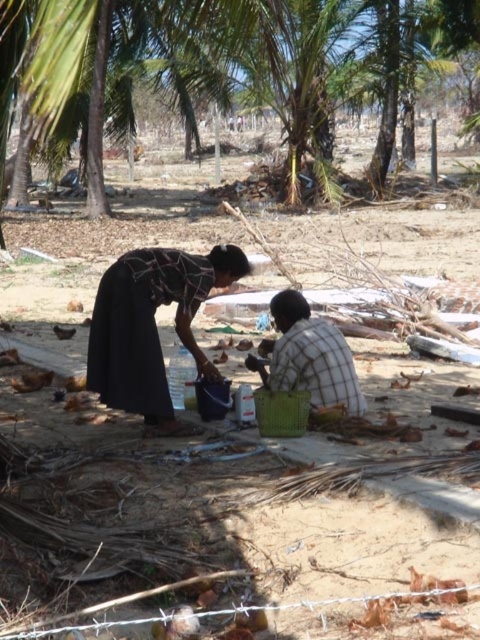
You are a worker in a coconut farm and need to place a 60 cm wide tool between the dark fabric skirt at center and the checkered fabric shirt at center. Can the tool fit between them without overlapping either?

The dark fabric skirt at center and checkered fabric shirt at center are 63.34 centimeters apart from each other. Since the tool is 60 cm wide, it can fit between them as the distance is sufficient.

You are a clothing designer observing the scene. You need to determine which fabric item, the dark fabric skirt at center or the checkered fabric shirt at center, requires more material to produce. Based on the scene description, which one would require more fabric?

The dark fabric skirt at center requires more fabric to produce because it is larger in size than the checkered fabric shirt at center.